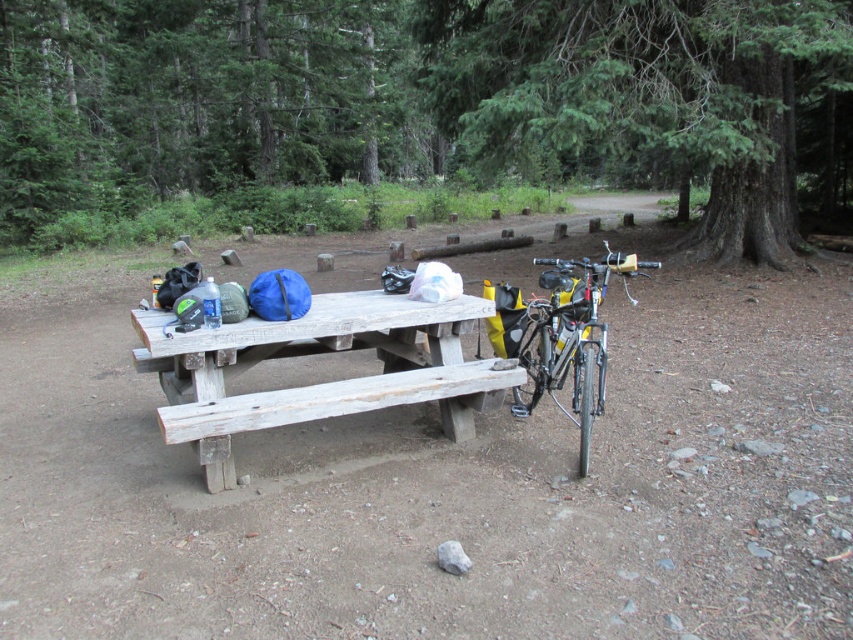
Which is in front, point (271, 420) or point (590, 292)?

Point (271, 420) is more forward.

Can you confirm if weathered wood picnic table at center is shorter than shiny metallic bicycle at right?

Yes, weathered wood picnic table at center is shorter than shiny metallic bicycle at right.

The image size is (853, 640). What do you see at coordinates (318, 384) in the screenshot?
I see `weathered wood picnic table at center` at bounding box center [318, 384].

Where is `weathered wood picnic table at center`? Image resolution: width=853 pixels, height=640 pixels. weathered wood picnic table at center is located at coordinates (318, 384).

Can you confirm if green textured tree at upper center is positioned to the right of green textured tree at upper right?

No, green textured tree at upper center is not to the right of green textured tree at upper right.

Is green textured tree at upper center wider than green textured tree at upper right?

Yes, green textured tree at upper center is wider than green textured tree at upper right.

Where is `green textured tree at upper center`? Image resolution: width=853 pixels, height=640 pixels. green textured tree at upper center is located at coordinates (198, 100).

Is green textured tree at upper right positioned behind weathered wood picnic table at center?

That is True.

Which is in front, point (788, 237) or point (199, 424)?

Point (199, 424) is more forward.

Find the location of a particular element. green textured tree at upper right is located at coordinates (647, 93).